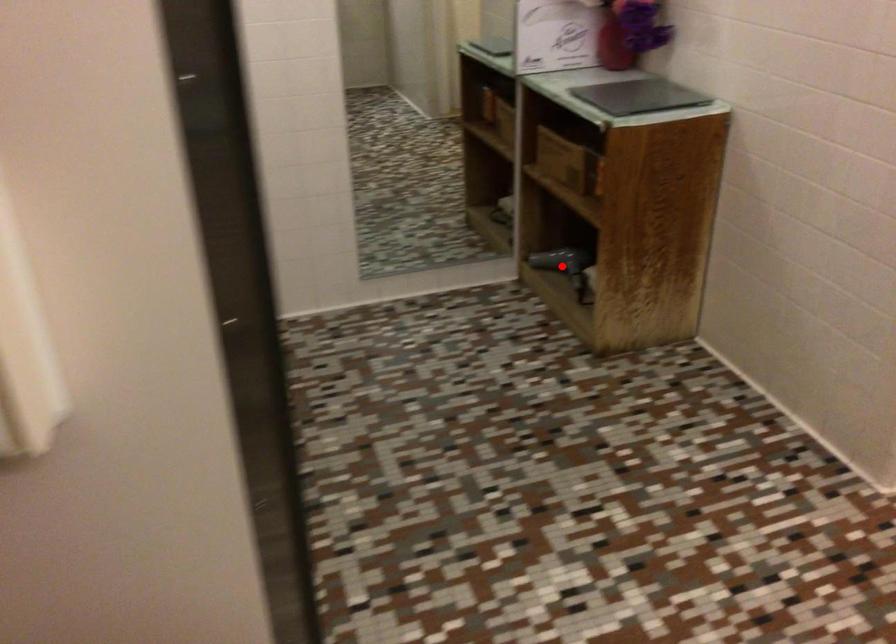
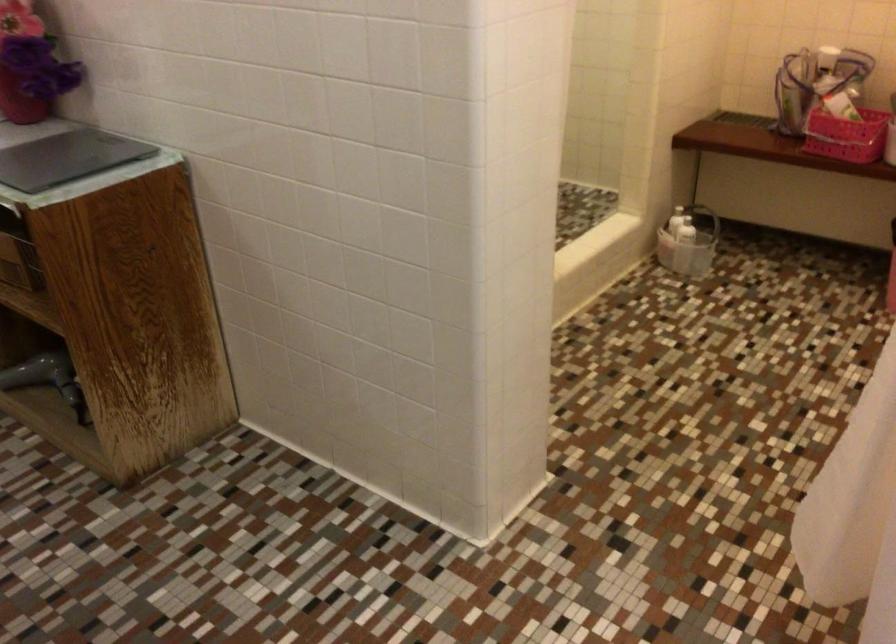
Question: I am providing you with two images of the same scene from different viewpoints. Given a red point in image1, look at the same physical point in image2. Is it:

Choices:
 (A) Closer to the viewpoint
 (B) Farther from the viewpoint

Answer: (A)